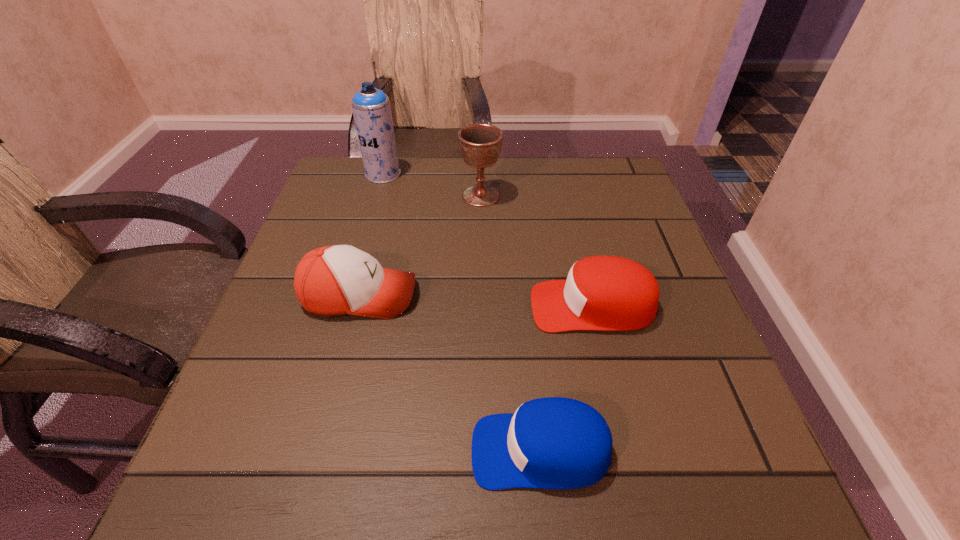
Find the location of a particular element. free space located on the front-facing side of the shortest baseball cap is located at coordinates (357, 450).

At what (x,y) coordinates should I click in order to perform the action: click on free spot located 0.350m on the front-facing side of the shortest baseball cap. Please return your answer as a coordinate pair (x, y). This screenshot has width=960, height=540. Looking at the image, I should click on (235, 450).

Image resolution: width=960 pixels, height=540 pixels. I want to click on vacant region located on the front-facing side of the shortest baseball cap, so click(357, 450).

In order to click on aerosol can that is at the far edge in this screenshot , I will do `click(371, 108)`.

At what (x,y) coordinates should I click in order to perform the action: click on chalice present at the far edge. Please return your answer as a coordinate pair (x, y). Looking at the image, I should click on (480, 144).

Locate an element on the screen. The image size is (960, 540). object that is positioned at the near edge is located at coordinates (550, 443).

Where is `aerosol can that is positioned at the left edge`? Image resolution: width=960 pixels, height=540 pixels. aerosol can that is positioned at the left edge is located at coordinates (371, 108).

Where is `baseball cap that is at the left edge`? This screenshot has height=540, width=960. baseball cap that is at the left edge is located at coordinates 335,280.

The image size is (960, 540). Find the location of `object that is at the right edge`. object that is at the right edge is located at coordinates (603, 293).

At what (x,y) coordinates should I click in order to perform the action: click on object at the far left corner. Please return your answer as a coordinate pair (x, y). The height and width of the screenshot is (540, 960). Looking at the image, I should click on (371, 108).